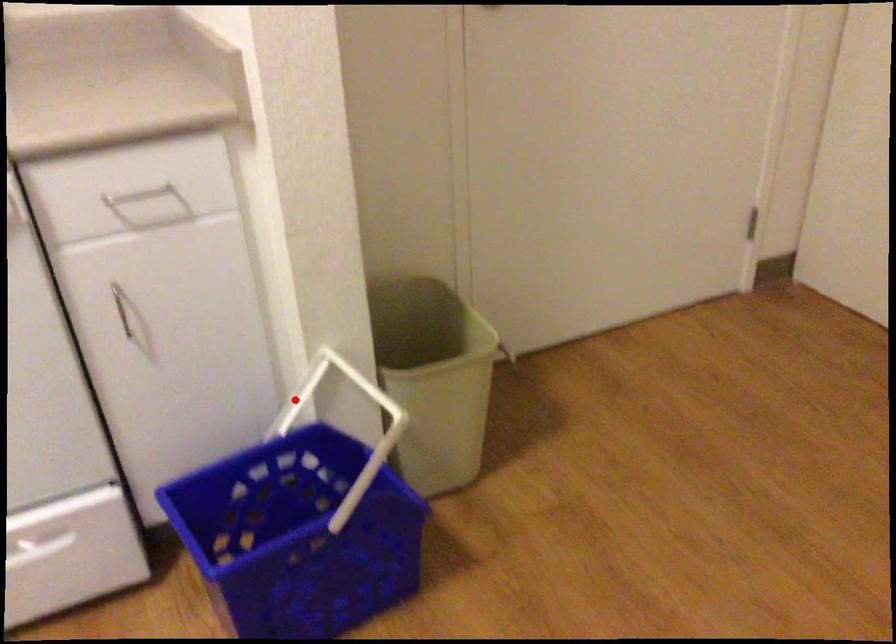
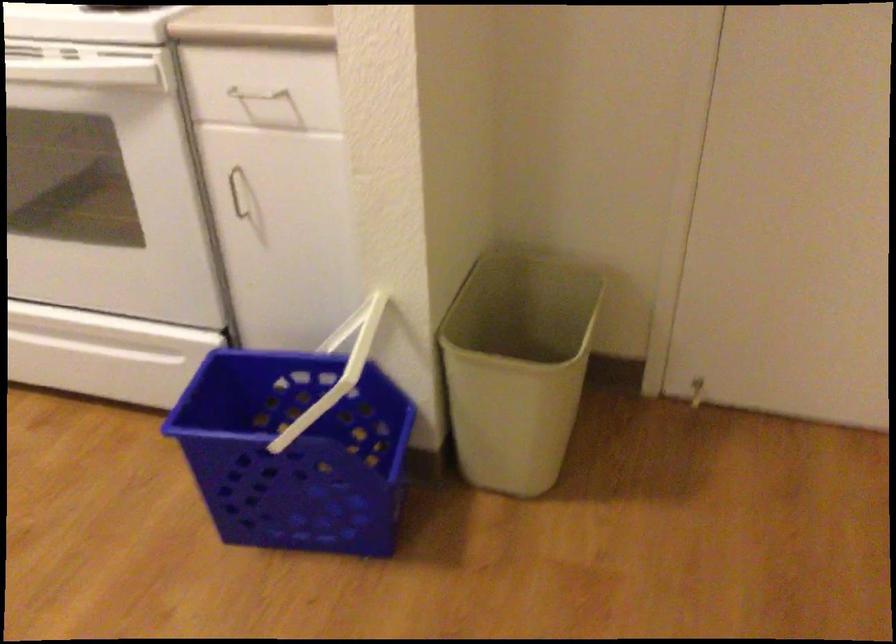
In the second image, find the point that corresponds to the highlighted location in the first image.

(346, 328)